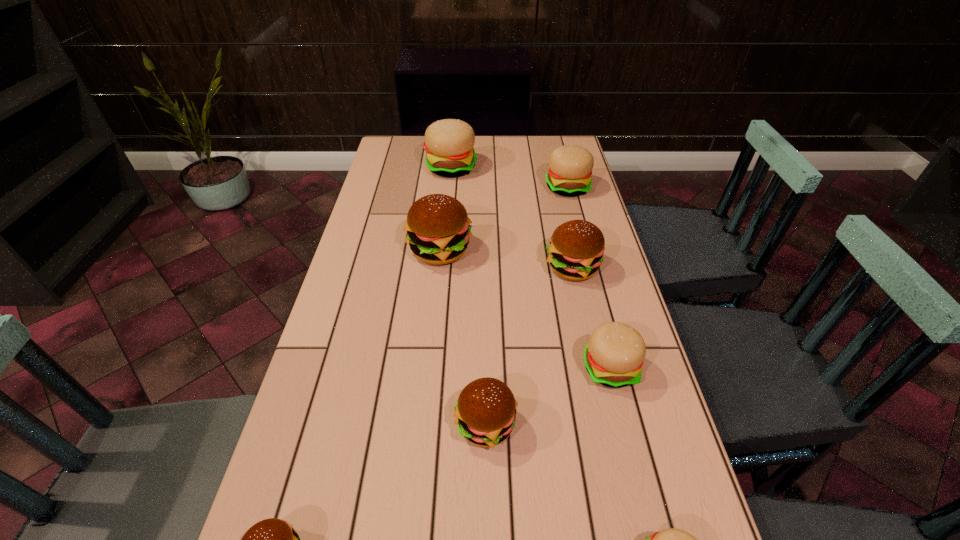
The height and width of the screenshot is (540, 960). Identify the location of free space that is in between the third nearest object and the leftmost beige hamburger. (468, 296).

Identify which object is the fifth closest to the rightmost brown hamburger. Please provide its 2D coordinates. Your answer should be formatted as a tuple, i.e. [(x, y)], where the tuple contains the x and y coordinates of a point satisfying the conditions above.

[(449, 143)]

Locate an element on the screen. The width and height of the screenshot is (960, 540). object that is the fifth closest one to the third smallest beige hamburger is located at coordinates (485, 412).

Select which hamburger is the fourth closest to the third smallest brown hamburger. Please provide its 2D coordinates. Your answer should be formatted as a tuple, i.e. [(x, y)], where the tuple contains the x and y coordinates of a point satisfying the conditions above.

[(485, 412)]

Image resolution: width=960 pixels, height=540 pixels. In order to click on the closest hamburger relative to the rightmost brown hamburger in this screenshot , I will do `click(614, 355)`.

Locate an element on the screen. This screenshot has height=540, width=960. brown hamburger object that ranks as the closest to the third smallest beige hamburger is located at coordinates (575, 252).

Find the location of a particular element. The image size is (960, 540). the third closest brown hamburger to the fifth farthest hamburger is located at coordinates (438, 228).

Identify which beige hamburger is the nearest to the nearest beige hamburger. Please provide its 2D coordinates. Your answer should be formatted as a tuple, i.e. [(x, y)], where the tuple contains the x and y coordinates of a point satisfying the conditions above.

[(614, 355)]

You are a GUI agent. You are given a task and a screenshot of the screen. Output one action in this format:
    pyautogui.click(x=<x>, y=<y>)
    Task: Click on the beige hamburger that is the nearest to the third biggest beige hamburger
    
    Given the screenshot: What is the action you would take?
    pyautogui.click(x=672, y=539)

Where is `blank space that satisfies the following two spatial constraints: 1. on the front side of the biggest beige hamburger; 2. on the right side of the third smallest beige hamburger`? blank space that satisfies the following two spatial constraints: 1. on the front side of the biggest beige hamburger; 2. on the right side of the third smallest beige hamburger is located at coordinates (449, 187).